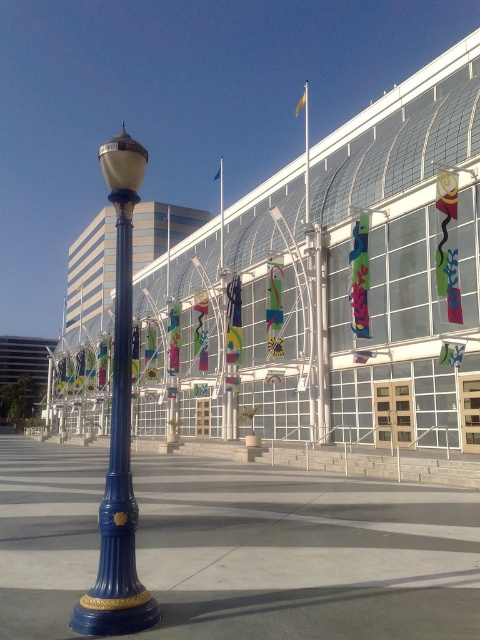
Describe the element at coordinates (303, 554) in the screenshot. I see `blue concrete pavement at lower left` at that location.

Is point (212, 552) in front of point (115, 410)?

No, (212, 552) is behind (115, 410).

Identify the location of blue concrete pavement at lower left. (303, 554).

Consider the image. Is blue glass building at center taller than blue glossy lamp post at left?

No, blue glass building at center is not taller than blue glossy lamp post at left.

Is point (133, 273) behind point (117, 305)?

Yes, point (133, 273) is behind point (117, 305).

This screenshot has height=640, width=480. What do you see at coordinates (334, 300) in the screenshot?
I see `blue glass building at center` at bounding box center [334, 300].

Identify the location of blue glass building at center. The image size is (480, 640). (334, 300).

Is blue glass building at center to the right of blue concrete pavement at lower left from the viewer's perspective?

No, blue glass building at center is not to the right of blue concrete pavement at lower left.

Is point (265, 291) positioned after point (39, 492)?

Yes, point (265, 291) is behind point (39, 492).

Where is `blue glass building at center`? blue glass building at center is located at coordinates (334, 300).